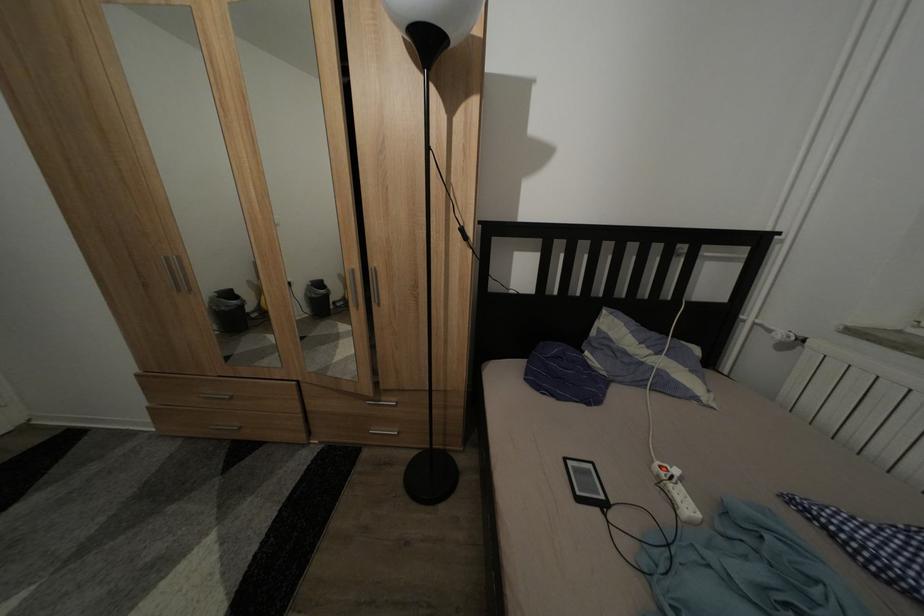
Where would you lift the black e-reader? Please return your answer as a coordinate pair (x, y).

(586, 483)